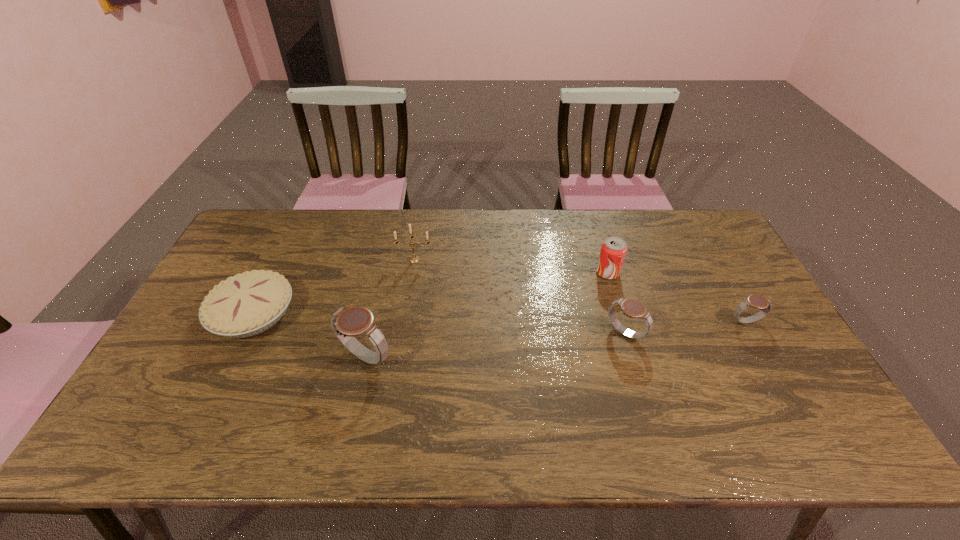
If we want them evenly spaced by inserting an extra watch among them, please locate a free spot for this new watch. Please provide its 2D coordinates. Your answer should be formatted as a tuple, i.e. [(x, y)], where the tuple contains the x and y coordinates of a point satisfying the conditions above.

[(498, 345)]